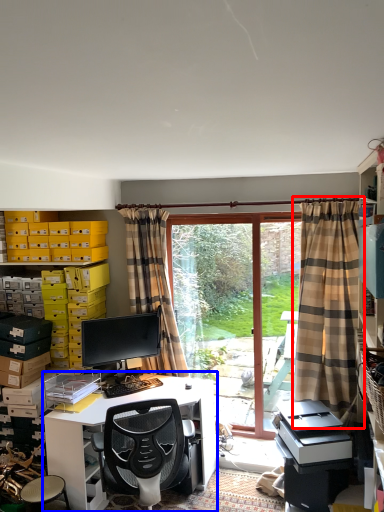
Question: Among these objects, which one is nearest to the camera, curtain (highlighted by a red box) or computer desk (highlighted by a blue box)?

Choices:
 (A) curtain
 (B) computer desk

Answer: (B)